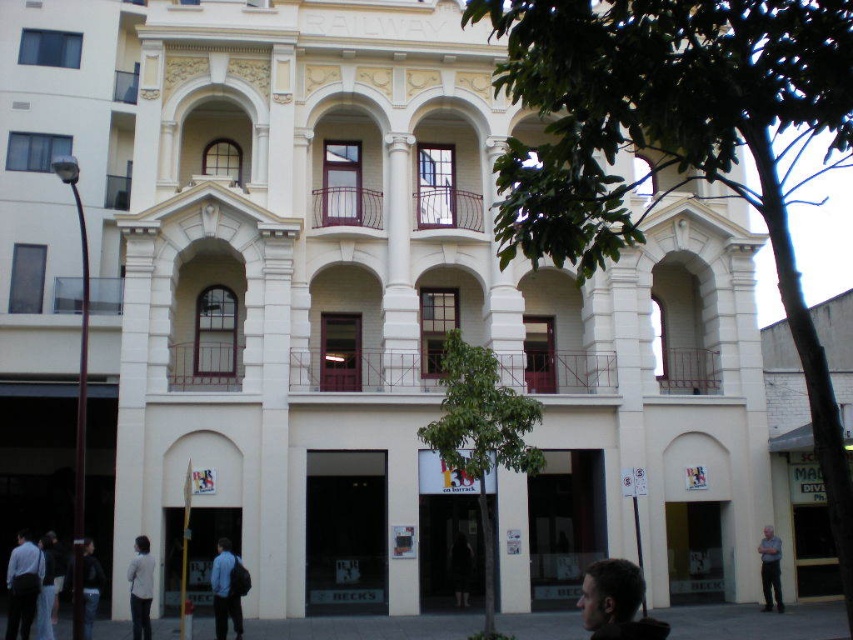
You are a photographer standing in front of the classical building. You notice two people in the scene. One has dark brown hair at lower right and another is wearing a dark blue jacket at lower left. Which of these two people appears taller in the photo?

The dark brown hair at lower right appears taller than the dark blue jacket at lower left in the photo.

You are standing in front of the building and notice two points marked on its facade. The first point is at coordinate point (x=621, y=636) and the second is at point (x=86, y=636). Which point appears closer to you?

Point (x=621, y=636) is closer to the camera than point (x=86, y=636), so the first point appears closer to you.

You are standing in front of the multi story building and see the blue fabric jacket at lower center and the dark blue shirt at lower left. Which one is positioned more to the right side?

The blue fabric jacket at lower center is positioned more to the right side than the dark blue shirt at lower left.